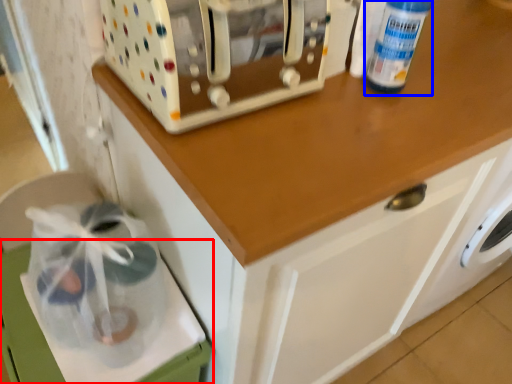
Question: Among these objects, which one is farthest to the camera, cabinetry (highlighted by a red box) or bottle (highlighted by a blue box)?

Choices:
 (A) cabinetry
 (B) bottle

Answer: (A)